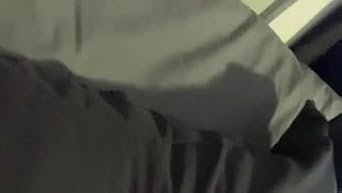
The height and width of the screenshot is (193, 342). What are the coordinates of `pillow` in the screenshot? It's located at (179, 36).